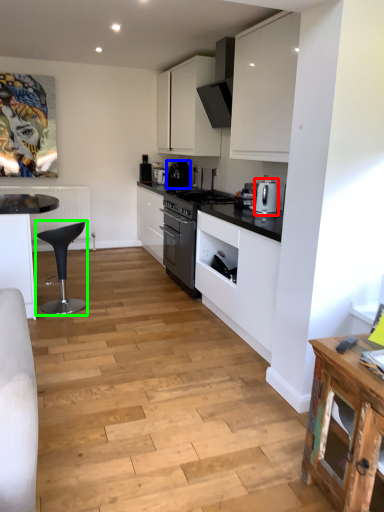
Question: Based on their relative distances, which object is nearer to kitchen appliance (highlighted by a red box)? Choose from kitchen appliance (highlighted by a blue box) and bar stool (highlighted by a green box).

Choices:
 (A) kitchen appliance
 (B) bar stool

Answer: (B)